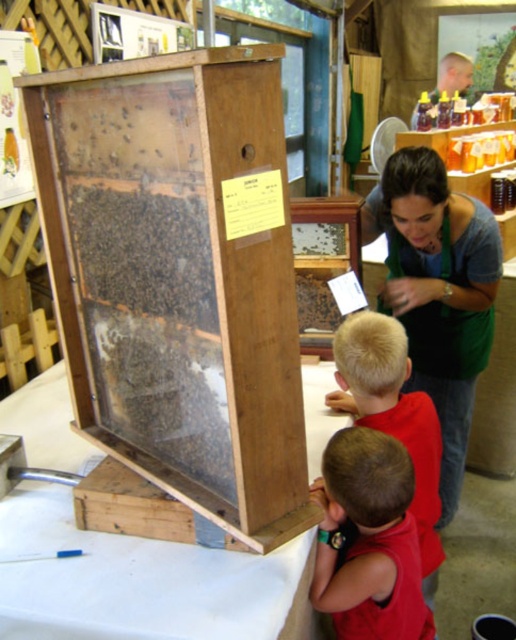
You are a visitor at a nature exhibit and see the green fabric apron at center and the translucent wood bee at center. Which object is closer to you?

The green fabric apron at center is closer to you because it is further to the viewer than the translucent wood bee at center.

You are a tailor who needs to know the size of the green fabric apron at center and the translucent wood bee at center to create a replica. Which object is bigger?

The green fabric apron at center is larger in size compared to the translucent wood bee at center.

You are standing in front of the bee observation box and notice a specific point marked at coordinates (x=179, y=276). Based on the scene description, what object is located at this point?

The point at coordinates (x=179, y=276) corresponds to the wooden beehive at center.